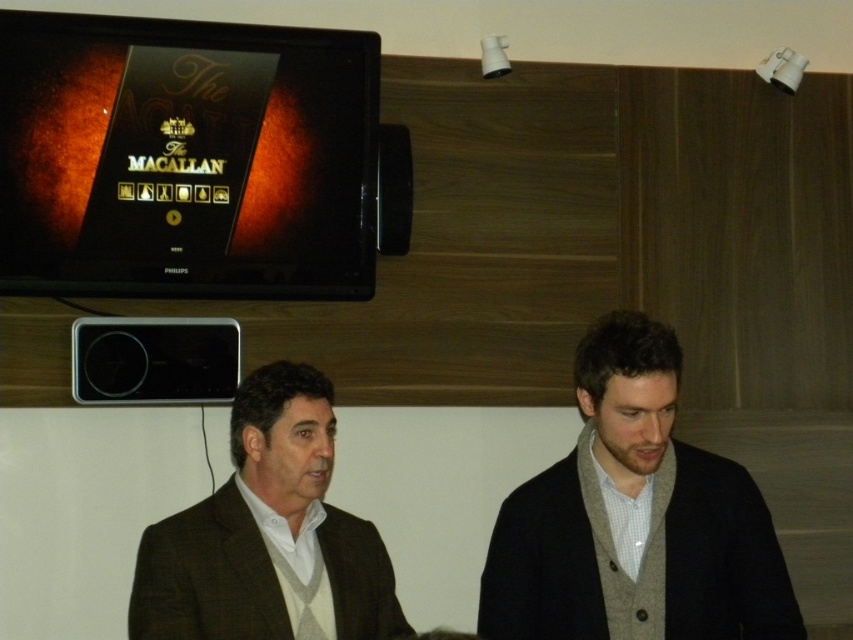
What are the coordinates of the dark brown wool sweater at right in the image?

The dark brown wool sweater at right is located at coordinates [635,518].

You are organizing a small event and need to place a decorative item on a shelf. The shelf has limited space, and you want to ensure that both the dark brown wool sweater at right and the black plastic speaker at upper left can fit side by side. Based on their sizes, can they both fit if the shelf is 1.2 meters wide?

The dark brown wool sweater at right might be wider than the black plastic speaker at upper left, so there is uncertainty about whether they can fit side by side on a 1.2 meter shelf. Measure their widths to confirm.

You are a furniture designer who wants to place a 36 inch wide sofa between the brown woolen sweater at center and the black plastic speaker at upper center. Can you fit the sofa between them?

The distance between the brown woolen sweater at center and the black plastic speaker at upper center is 36.65 inches, so a 36 inch wide sofa can fit between them with a small gap remaining.